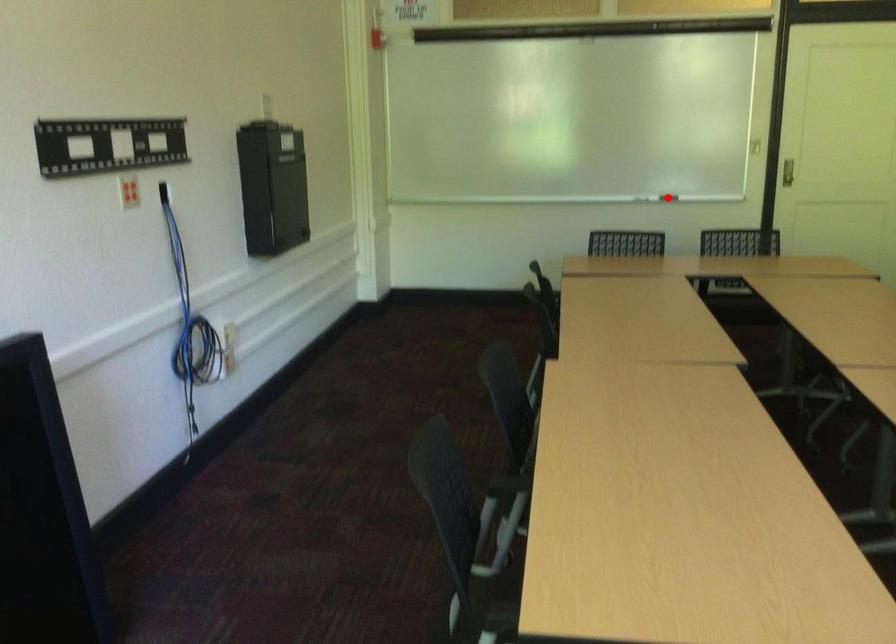
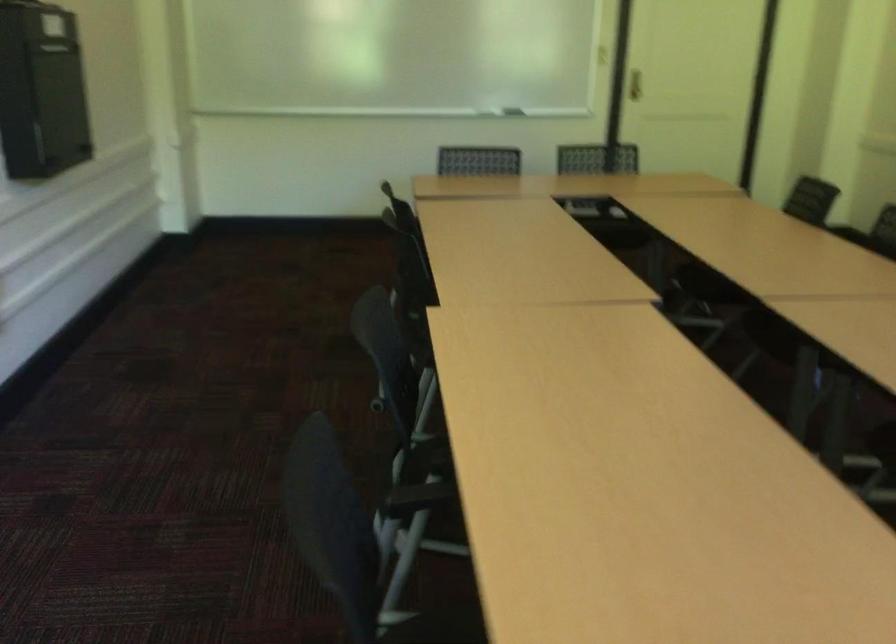
Question: I am providing you with two images of the same scene from different viewpoints. A red point is marked on the first image. Can you still see the location of the red point in image 2?

Choices:
 (A) Yes
 (B) No

Answer: (B)